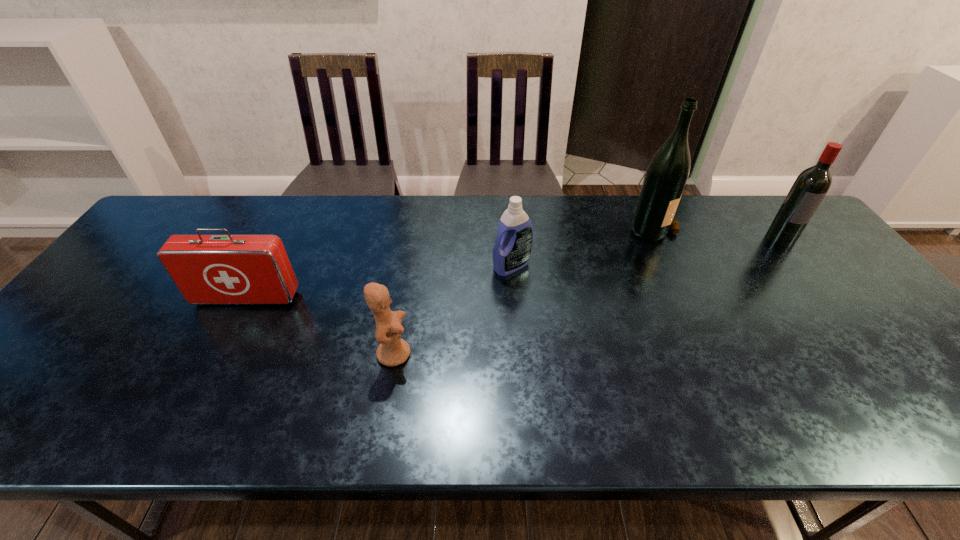
In order to click on vacant region between the right wine bottle and the figurine in this screenshot , I will do click(588, 296).

Where is `object that stands as the closest to the right wine bottle`? object that stands as the closest to the right wine bottle is located at coordinates (666, 175).

Select which object is the second closest to the detergent. Please provide its 2D coordinates. Your answer should be formatted as a tuple, i.e. [(x, y)], where the tuple contains the x and y coordinates of a point satisfying the conditions above.

[(666, 175)]